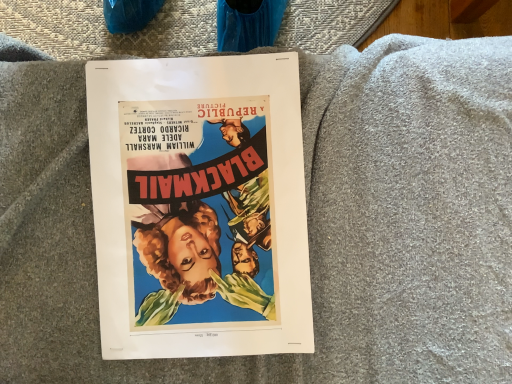
Identify the location of free space above vibrant paper poster at center (from a real-world perspective). (197, 201).